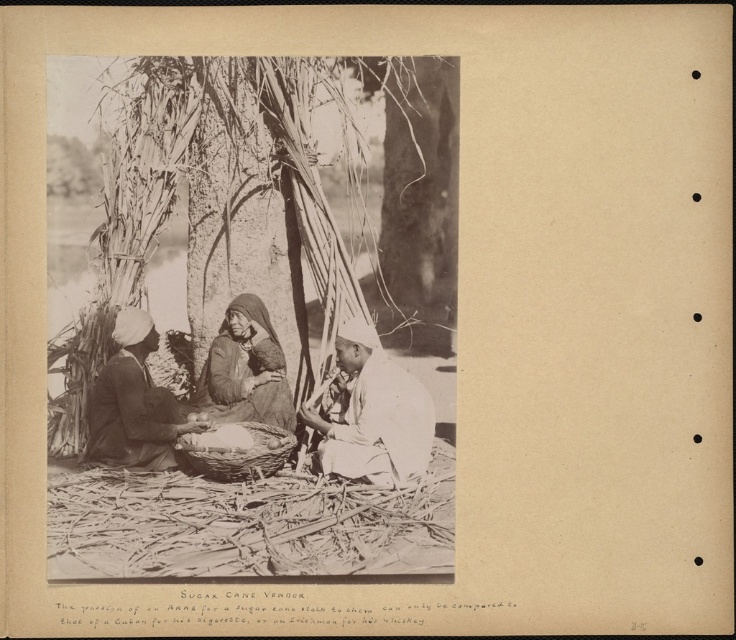
Question: Which point appears closest to the camera in this image?

Choices:
 (A) coord(109,371)
 (B) coord(417,346)
 (C) coord(325,467)
 (D) coord(233,387)

Answer: (C)

Question: Can you confirm if dark brown fabric turban at lower left is bigger than dark brown fabric at center?

Choices:
 (A) yes
 (B) no

Answer: (A)

Question: Is white cloth at center to the left of dark brown fabric turban at lower left from the viewer's perspective?

Choices:
 (A) no
 (B) yes

Answer: (A)

Question: Can you confirm if dark brown fabric turban at lower left is thinner than dark brown fabric at center?

Choices:
 (A) yes
 (B) no

Answer: (B)

Question: Which object is closer to the camera taking this photo?

Choices:
 (A) dark brown fabric at center
 (B) dark brown fabric turban at lower left

Answer: (B)

Question: Which of the following is the farthest from the observer?

Choices:
 (A) (149, 401)
 (B) (453, 244)
 (C) (222, 339)

Answer: (B)